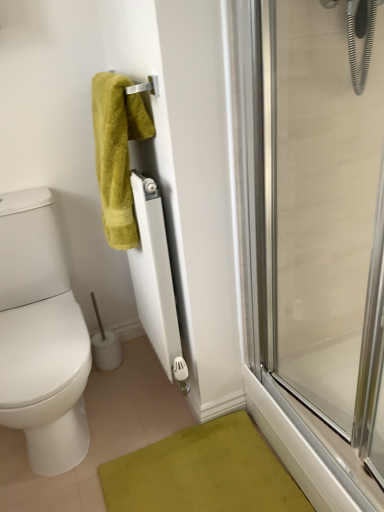
Question: Would you say white matte radiator at center is outside green fuzzy towel at upper left?

Choices:
 (A) no
 (B) yes

Answer: (B)

Question: From the image's perspective, is white matte radiator at center over green fuzzy towel at upper left?

Choices:
 (A) yes
 (B) no

Answer: (B)

Question: Is white matte radiator at center far from green fuzzy towel at upper left?

Choices:
 (A) yes
 (B) no

Answer: (B)

Question: Does white matte radiator at center have a smaller size compared to green fuzzy towel at upper left?

Choices:
 (A) yes
 (B) no

Answer: (B)

Question: From a real-world perspective, is white matte radiator at center on green fuzzy towel at upper left?

Choices:
 (A) no
 (B) yes

Answer: (A)

Question: Does white matte radiator at center have a greater width compared to green fuzzy towel at upper left?

Choices:
 (A) yes
 (B) no

Answer: (B)

Question: From a real-world perspective, does transparent glass shower door at right sit lower than green fuzzy towel at upper left?

Choices:
 (A) yes
 (B) no

Answer: (A)

Question: Is transparent glass shower door at right further to camera compared to green fuzzy towel at upper left?

Choices:
 (A) no
 (B) yes

Answer: (A)

Question: Is green fuzzy towel at upper left at the back of transparent glass shower door at right?

Choices:
 (A) yes
 (B) no

Answer: (B)

Question: Is transparent glass shower door at right smaller than green fuzzy towel at upper left?

Choices:
 (A) yes
 (B) no

Answer: (B)

Question: Considering the relative positions of transparent glass shower door at right and green fuzzy towel at upper left in the image provided, is transparent glass shower door at right to the right of green fuzzy towel at upper left from the viewer's perspective?

Choices:
 (A) no
 (B) yes

Answer: (B)

Question: Does transparent glass shower door at right have a larger size compared to green fuzzy towel at upper left?

Choices:
 (A) yes
 (B) no

Answer: (A)

Question: Is white matte radiator at center surrounding transparent glass shower door at right?

Choices:
 (A) no
 (B) yes

Answer: (A)